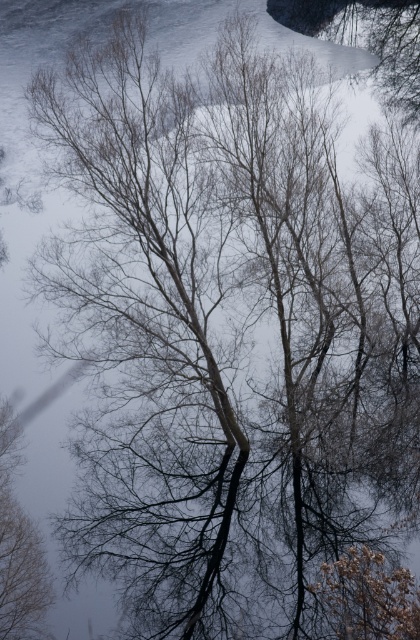
Who is positioned more to the left, brown textured tree at lower right or brown matte tree at left?

brown matte tree at left is more to the left.

Consider the image. Does brown textured tree at lower right appear on the left side of brown matte tree at left?

Incorrect, brown textured tree at lower right is not on the left side of brown matte tree at left.

At what (x,y) coordinates should I click in order to perform the action: click on brown textured tree at lower right. Please return your answer as a coordinate pair (x, y). The height and width of the screenshot is (640, 420). Looking at the image, I should click on (367, 596).

Identify the location of brown textured tree at lower right. The width and height of the screenshot is (420, 640). (367, 596).